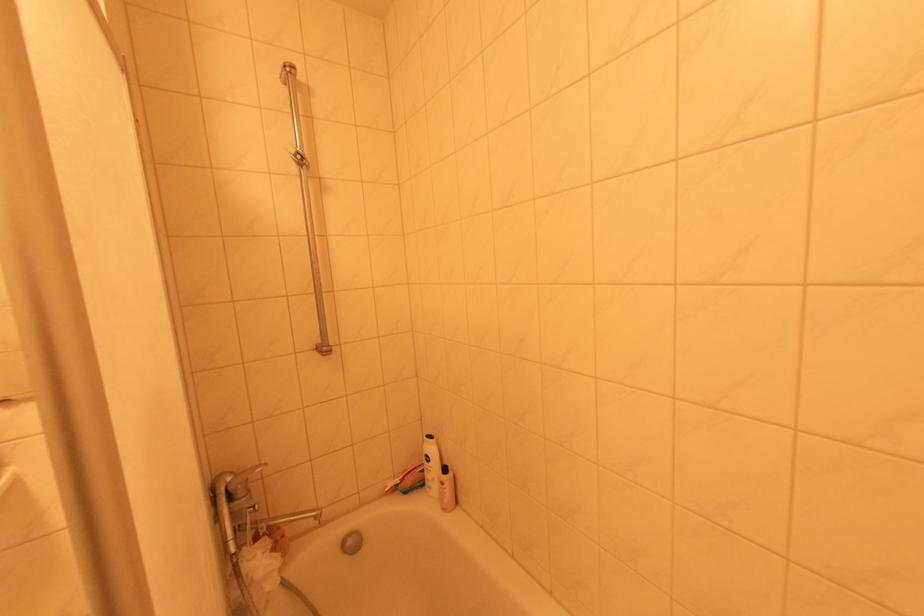
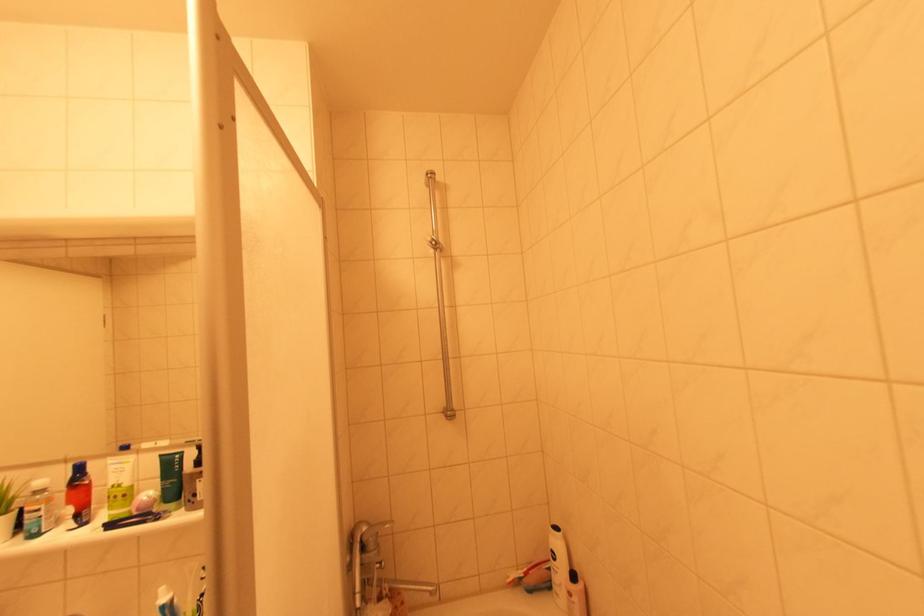
Question: In a continuous first-person perspective shot, in which direction is the camera moving?

Choices:
 (A) Left
 (B) Right
 (C) Forward
 (D) Backward

Answer: (B)